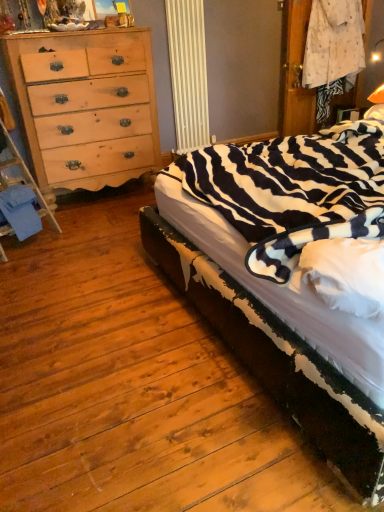
Image resolution: width=384 pixels, height=512 pixels. What are the coordinates of `blue fabric at lower left` in the screenshot? It's located at (20, 211).

How many degrees apart are the facing directions of natural wood dresser at left and blue fabric at lower left?

There is a 27.7-degree angle between the facing directions of natural wood dresser at left and blue fabric at lower left.

From a real-world perspective, between natural wood dresser at left and blue fabric at lower left, who is vertically higher?

natural wood dresser at left, from a real-world perspective.

Which of these two, natural wood dresser at left or blue fabric at lower left, is thinner?

Thinner between the two is blue fabric at lower left.

From the image's perspective, would you say natural wood dresser at left is shown under blue fabric at lower left?

No, from the image's perspective, natural wood dresser at left is not below blue fabric at lower left.

Looking at their sizes, would you say zebra-patterned fabric at right is wider or thinner than natural wood dresser at left?

Considering their sizes, zebra-patterned fabric at right looks broader than natural wood dresser at left.

Which of these two, zebra-patterned fabric at right or natural wood dresser at left, stands shorter?

zebra-patterned fabric at right is shorter.

From a real-world perspective, does zebra-patterned fabric at right sit lower than natural wood dresser at left?

Correct, in the physical world, zebra-patterned fabric at right is lower than natural wood dresser at left.

You are a GUI agent. You are given a task and a screenshot of the screen. Output one action in this format:
    pyautogui.click(x=<x>, y=<y>)
    Task: Click on the bed that appears on the right of natural wood dresser at left
    
    Given the screenshot: What is the action you would take?
    pyautogui.click(x=278, y=360)

From a real-world perspective, is natural wood dresser at left positioned above or below zebra-patterned fabric at right?

Clearly, from a real-world perspective, natural wood dresser at left is above zebra-patterned fabric at right.

In the scene shown: Which object is wider, natural wood dresser at left or zebra-patterned fabric at right?

zebra-patterned fabric at right is wider.

Is natural wood dresser at left positioned beyond the bounds of zebra-patterned fabric at right?

natural wood dresser at left lies outside zebra-patterned fabric at right's area.

Considering the points (41, 185) and (321, 371), which point is behind, point (41, 185) or point (321, 371)?

Positioned behind is point (41, 185).

Is natural wood dresser at left at the back of blue fabric at lower left?

That's not correct — blue fabric at lower left is not looking away from natural wood dresser at left.

Considering the positions of objects blue fabric at lower left and natural wood dresser at left in the image provided, who is behind, blue fabric at lower left or natural wood dresser at left?

natural wood dresser at left.

Where is `the chest of drawers that is above the blue fabric at lower left (from the image's perspective)`? the chest of drawers that is above the blue fabric at lower left (from the image's perspective) is located at coordinates (86, 106).

Is point (23, 197) closer or farther from the camera than point (324, 409)?

Point (23, 197) is farther from the camera than point (324, 409).

Which of these two, blue fabric at lower left or zebra-patterned fabric at right, is smaller?

blue fabric at lower left.

Is blue fabric at lower left in front of or behind zebra-patterned fabric at right in the image?

blue fabric at lower left is positioned farther from the viewer than zebra-patterned fabric at right.

Are blue fabric at lower left and zebra-patterned fabric at right located far from each other?

blue fabric at lower left is positioned a significant distance from zebra-patterned fabric at right.

Which object is positioned more to the right, zebra-patterned fabric at right or blue fabric at lower left?

From the viewer's perspective, zebra-patterned fabric at right appears more on the right side.

Is zebra-patterned fabric at right oriented away from blue fabric at lower left?

No.

Is zebra-patterned fabric at right far from blue fabric at lower left?

zebra-patterned fabric at right is positioned a significant distance from blue fabric at lower left.

Based on the photo, from a real-world perspective, is zebra-patterned fabric at right positioned above or below blue fabric at lower left?

From a real-world perspective, zebra-patterned fabric at right is physically above blue fabric at lower left.

Where is `the chest of drawers that appears behind the blue fabric at lower left`? This screenshot has height=512, width=384. the chest of drawers that appears behind the blue fabric at lower left is located at coordinates (86, 106).

Identify the location of bed that is below the natural wood dresser at left (from the image's perspective). The height and width of the screenshot is (512, 384). (278, 360).

Which object lies nearer to the anchor point blue fabric at lower left, natural wood dresser at left or zebra-patterned fabric at right?

natural wood dresser at left is closer to blue fabric at lower left.

From the image, which object appears to be farther from natural wood dresser at left, zebra-patterned fabric at right or blue fabric at lower left?

zebra-patterned fabric at right is further to natural wood dresser at left.

Looking at the image, which one is located closer to natural wood dresser at left, blue fabric at lower left or zebra-patterned fabric at right?

blue fabric at lower left.

Which object lies further to the anchor point zebra-patterned fabric at right, natural wood dresser at left or blue fabric at lower left?

natural wood dresser at left.

Based on their spatial positions, is blue fabric at lower left or natural wood dresser at left closer to zebra-patterned fabric at right?

The object closer to zebra-patterned fabric at right is blue fabric at lower left.

Considering their positions, is zebra-patterned fabric at right positioned further to blue fabric at lower left than natural wood dresser at left?

zebra-patterned fabric at right.

Where is `chest of drawers between blue fabric at lower left and zebra-patterned fabric at right`? This screenshot has height=512, width=384. chest of drawers between blue fabric at lower left and zebra-patterned fabric at right is located at coordinates (86, 106).